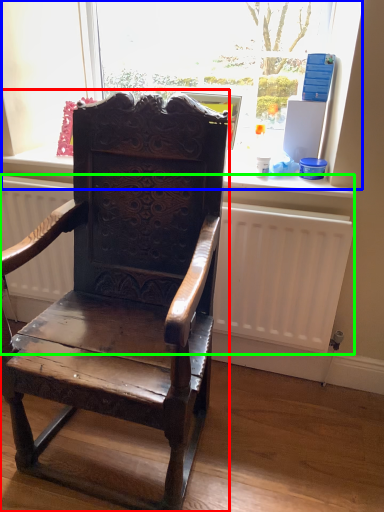
Question: Considering the real-world distances, which object is closest to chair (highlighted by a red box)? bay window (highlighted by a blue box) or radiator (highlighted by a green box).

Choices:
 (A) bay window
 (B) radiator

Answer: (B)